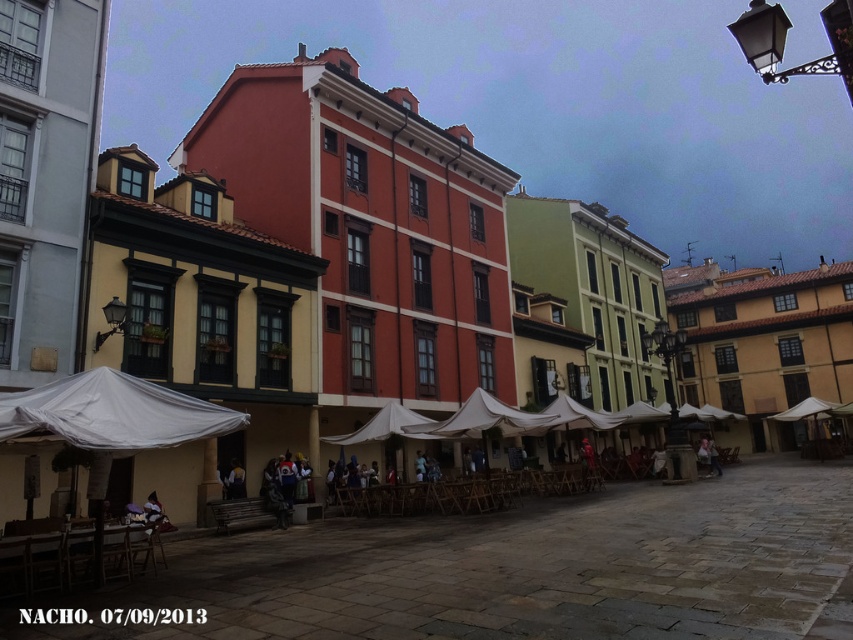
Can you confirm if white fabric canopy at lower left is positioned above leather jacket at center?

Correct, white fabric canopy at lower left is located above leather jacket at center.

Between white fabric canopy at lower left and leather jacket at center, which one appears on the left side from the viewer's perspective?

Positioned to the left is white fabric canopy at lower left.

Where is `white fabric canopy at lower left`? The image size is (853, 640). white fabric canopy at lower left is located at coordinates (112, 413).

Locate an element on the screen. The height and width of the screenshot is (640, 853). white fabric canopy at lower left is located at coordinates (112, 413).

Is white fabric canopy at center positioned at the back of leather jacket at center?

That is False.

Who is positioned more to the left, white fabric canopy at center or leather jacket at center?

Positioned to the left is white fabric canopy at center.

Who is more distant from viewer, (463,428) or (711,438)?

Point (711,438)

The image size is (853, 640). Identify the location of white fabric canopy at center. (485, 419).

Is point (19, 417) farther from viewer compared to point (498, 401)?

No, (19, 417) is in front of (498, 401).

Between white fabric canopy at lower left and white fabric canopy at center, which one is positioned lower?

white fabric canopy at center is below.

The height and width of the screenshot is (640, 853). Identify the location of white fabric canopy at lower left. (112, 413).